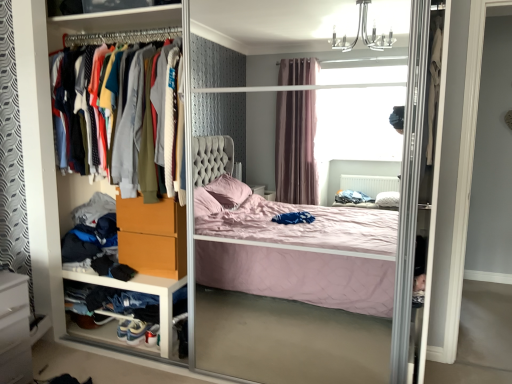
Where is `free point in front of white leather shoe at lower left, which ranks as the 1th shoe in right-to-left order`? This screenshot has height=384, width=512. free point in front of white leather shoe at lower left, which ranks as the 1th shoe in right-to-left order is located at coordinates (130, 356).